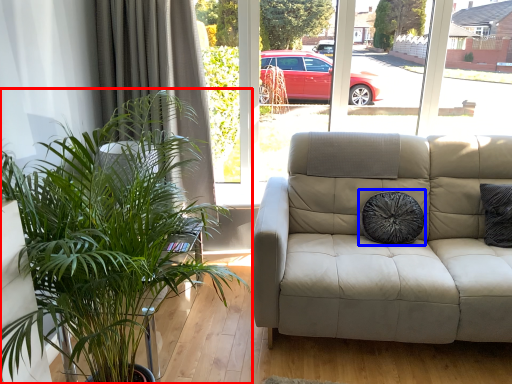
Question: Which of the following is the farthest to the observer, houseplant (highlighted by a red box) or pillow (highlighted by a blue box)?

Choices:
 (A) houseplant
 (B) pillow

Answer: (B)